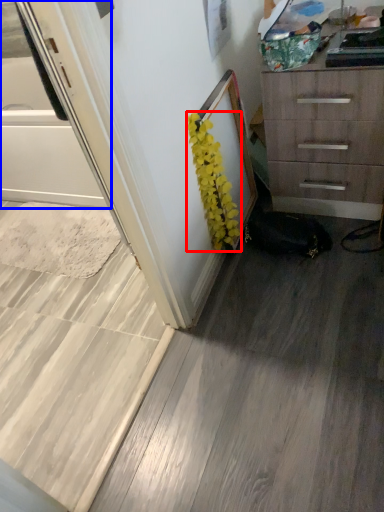
Question: Which point is further to the camera, flower (highlighted by a red box) or screen door (highlighted by a blue box)?

Choices:
 (A) flower
 (B) screen door

Answer: (A)